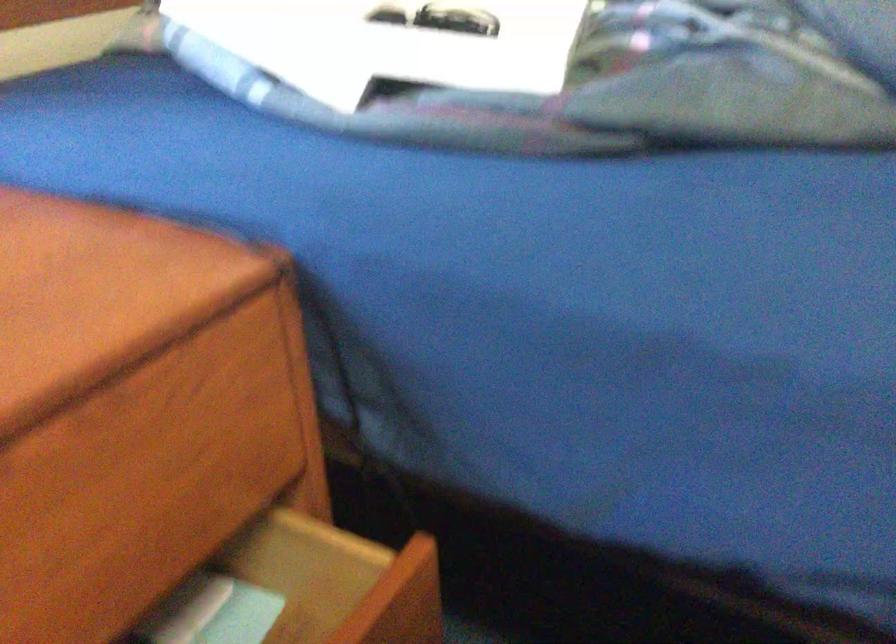
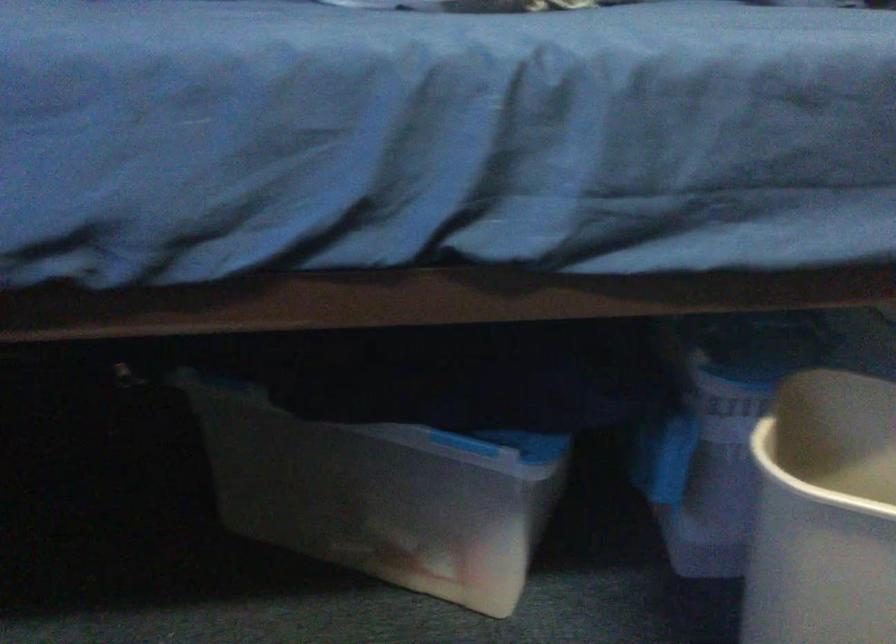
Question: The first image is from the beginning of the video and the second image is from the end. How did the camera likely rotate when shooting the video?

Choices:
 (A) Left
 (B) Right
 (C) Up
 (D) Down

Answer: (B)